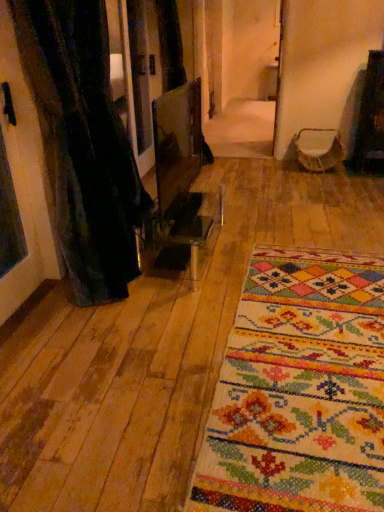
Question: Should I look upward or downward to see multicolored woven rug at center?

Choices:
 (A) up
 (B) down

Answer: (B)

Question: Is multicolored woven rug at center wider than black textured curtain at left?

Choices:
 (A) yes
 (B) no

Answer: (A)

Question: Is multicolored woven rug at center positioned before black textured curtain at left?

Choices:
 (A) no
 (B) yes

Answer: (B)

Question: Are multicolored woven rug at center and black textured curtain at left making contact?

Choices:
 (A) no
 (B) yes

Answer: (A)

Question: Would you say multicolored woven rug at center is outside black textured curtain at left?

Choices:
 (A) no
 (B) yes

Answer: (B)

Question: Is multicolored woven rug at center smaller than black textured curtain at left?

Choices:
 (A) yes
 (B) no

Answer: (A)

Question: Does multicolored woven rug at center have a greater height compared to black textured curtain at left?

Choices:
 (A) no
 (B) yes

Answer: (A)

Question: Considering the relative sizes of multicolored woven rug at center and velvet-like beige armchair at center in the image provided, is multicolored woven rug at center wider than velvet-like beige armchair at center?

Choices:
 (A) yes
 (B) no

Answer: (A)

Question: Considering the relative sizes of multicolored woven rug at center and velvet-like beige armchair at center in the image provided, is multicolored woven rug at center taller than velvet-like beige armchair at center?

Choices:
 (A) yes
 (B) no

Answer: (B)

Question: Is multicolored woven rug at center touching velvet-like beige armchair at center?

Choices:
 (A) yes
 (B) no

Answer: (B)

Question: Does multicolored woven rug at center have a lesser height compared to velvet-like beige armchair at center?

Choices:
 (A) no
 (B) yes

Answer: (B)

Question: Is multicolored woven rug at center turned away from velvet-like beige armchair at center?

Choices:
 (A) no
 (B) yes

Answer: (B)

Question: Can you confirm if multicolored woven rug at center is bigger than velvet-like beige armchair at center?

Choices:
 (A) yes
 (B) no

Answer: (A)

Question: Is velvet-like beige armchair at center bigger than multicolored woven rug at center?

Choices:
 (A) no
 (B) yes

Answer: (A)